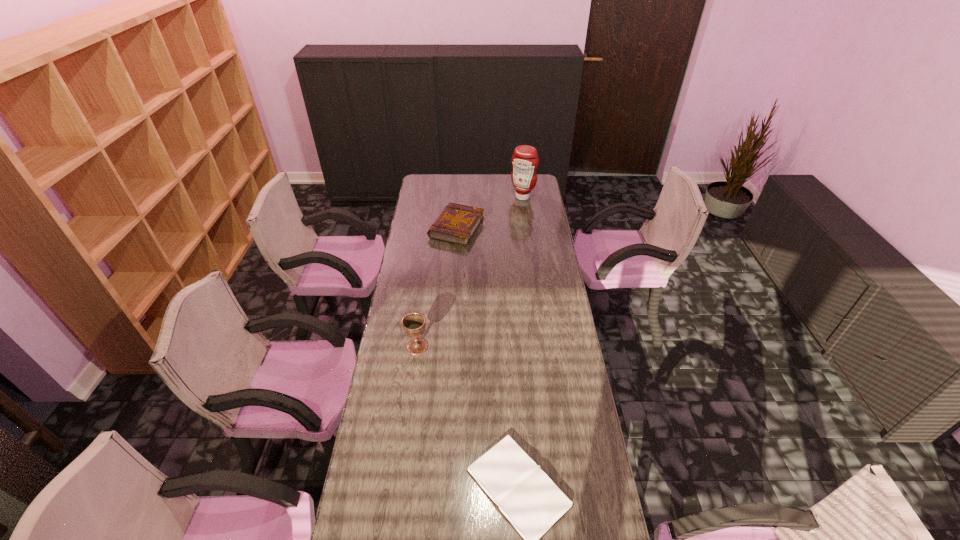
This screenshot has width=960, height=540. Identify the location of condiment. (525, 160).

Where is `the tallest object`? the tallest object is located at coordinates (525, 160).

Image resolution: width=960 pixels, height=540 pixels. What are the coordinates of `the third shortest object` in the screenshot? It's located at (414, 323).

The width and height of the screenshot is (960, 540). Identify the location of chalice. (414, 323).

The width and height of the screenshot is (960, 540). Identify the location of the second shortest object. (457, 224).

Locate an element on the screen. The width and height of the screenshot is (960, 540). the farther hardback book is located at coordinates (457, 224).

Locate an element on the screen. The image size is (960, 540). free location located 0.070m on the back of the condiment is located at coordinates (521, 185).

Where is `free location located on the front of the second nearest object`? This screenshot has width=960, height=540. free location located on the front of the second nearest object is located at coordinates (407, 419).

The width and height of the screenshot is (960, 540). In order to click on free location located 0.200m on the back of the third nearest object in this screenshot , I will do `click(459, 192)`.

Identify the location of object that is at the far edge. Image resolution: width=960 pixels, height=540 pixels. (525, 160).